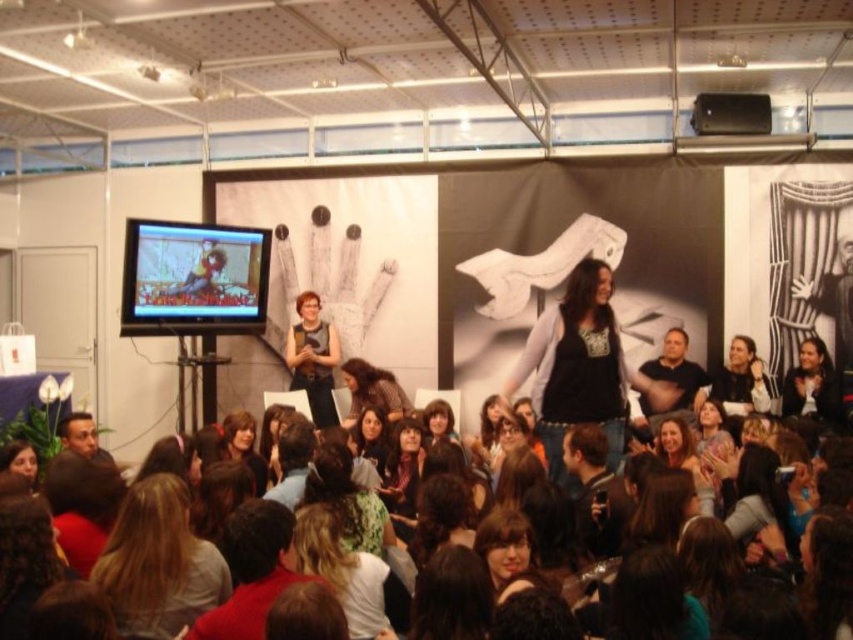
Question: Does black matte speaker at upper center lie in front of matte black shirt at center?

Choices:
 (A) yes
 (B) no

Answer: (B)

Question: Which object appears farthest from the camera in this image?

Choices:
 (A) dark brown leather jacket at center
 (B) matte black screen at left

Answer: (B)

Question: Among these objects, which one is nearest to the camera?

Choices:
 (A) matte black screen at left
 (B) dark brown leather jacket at center
 (C) dark brown hair at lower left

Answer: (C)

Question: Is matte black dress at center to the right of dark brown leather jacket at center from the viewer's perspective?

Choices:
 (A) yes
 (B) no

Answer: (B)

Question: Is dark brown hair at lower left positioned in front of black matte speaker at upper center?

Choices:
 (A) no
 (B) yes

Answer: (B)

Question: Which object is the closest to the black matte speaker at upper center?

Choices:
 (A) matte black shirt at center
 (B) black fabric jacket at upper right
 (C) dark brown hair at lower left

Answer: (B)